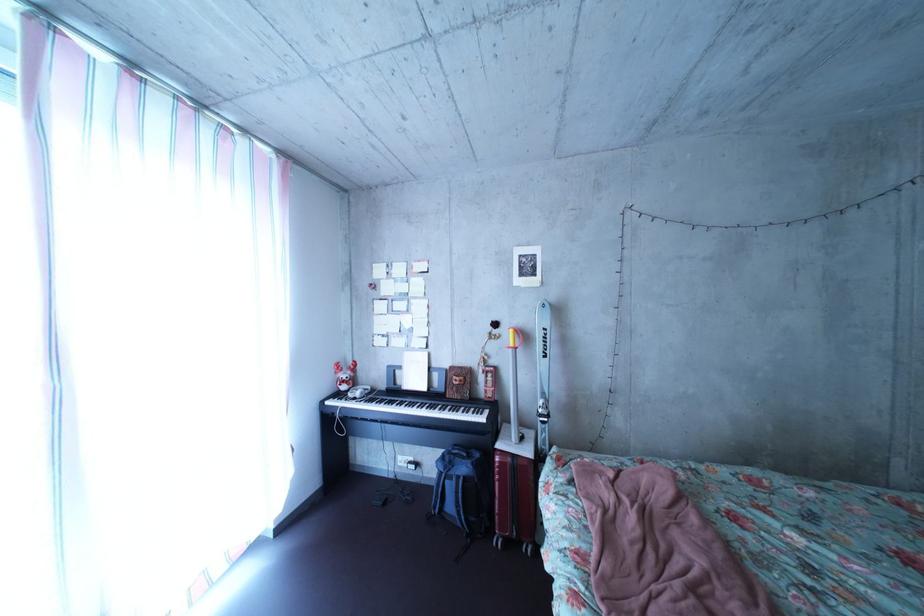
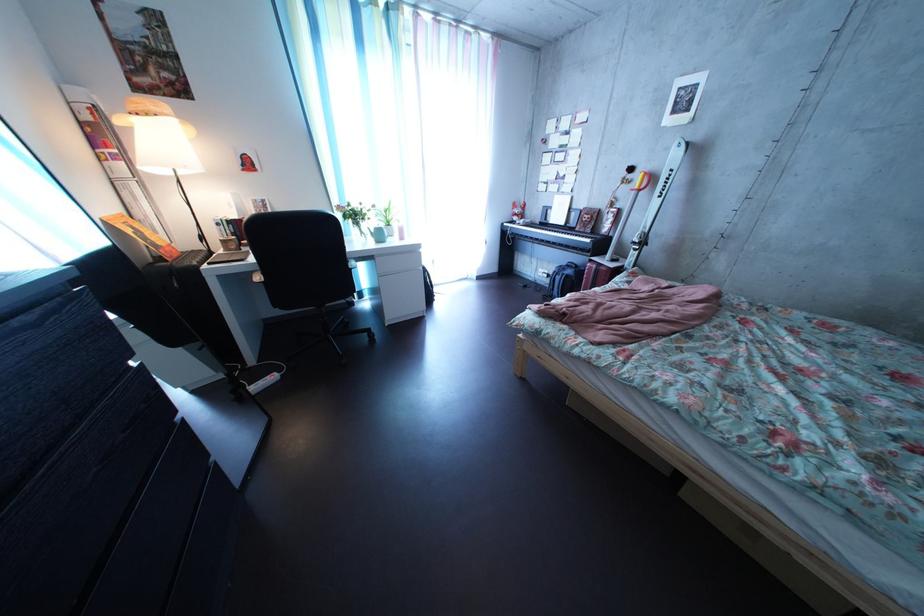
In the second image, find the point that corresponds to pixel 440 398 in the first image.

(577, 232)